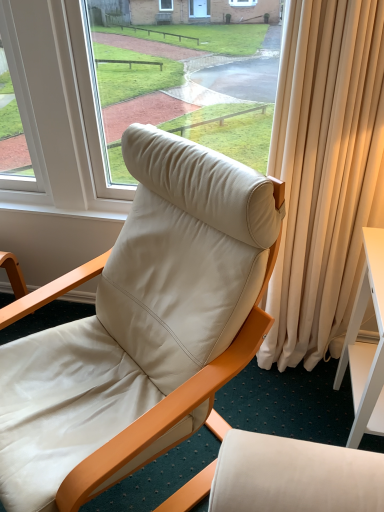
Question: From the image's perspective, is white glossy desk at right located above or below matte white leather chair at center?

Choices:
 (A) below
 (B) above

Answer: (A)

Question: Considering the positions of white glossy desk at right and matte white leather chair at center in the image, is white glossy desk at right taller or shorter than matte white leather chair at center?

Choices:
 (A) short
 (B) tall

Answer: (A)

Question: In terms of width, does white glossy desk at right look wider or thinner when compared to matte white leather chair at center?

Choices:
 (A) wide
 (B) thin

Answer: (B)

Question: In terms of height, does matte white leather chair at center look taller or shorter compared to white glossy desk at right?

Choices:
 (A) tall
 (B) short

Answer: (A)

Question: Is matte white leather chair at center to the left or to the right of white glossy desk at right in the image?

Choices:
 (A) right
 (B) left

Answer: (B)

Question: Does point (x=117, y=248) appear closer or farther from the camera than point (x=362, y=394)?

Choices:
 (A) farther
 (B) closer

Answer: (A)

Question: From a real-world perspective, is matte white leather chair at center physically located above or below white glossy desk at right?

Choices:
 (A) below
 (B) above

Answer: (B)